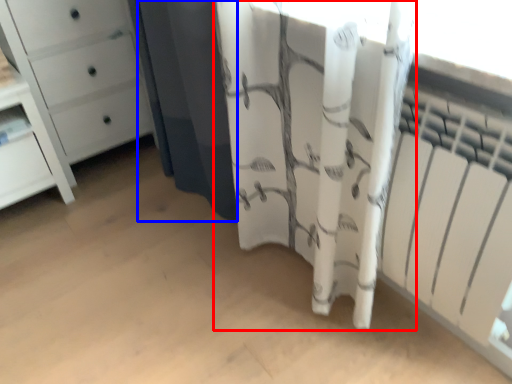
Question: Which object appears closest to the camera in this image, curtain (highlighted by a red box) or shower curtain (highlighted by a blue box)?

Choices:
 (A) curtain
 (B) shower curtain

Answer: (A)